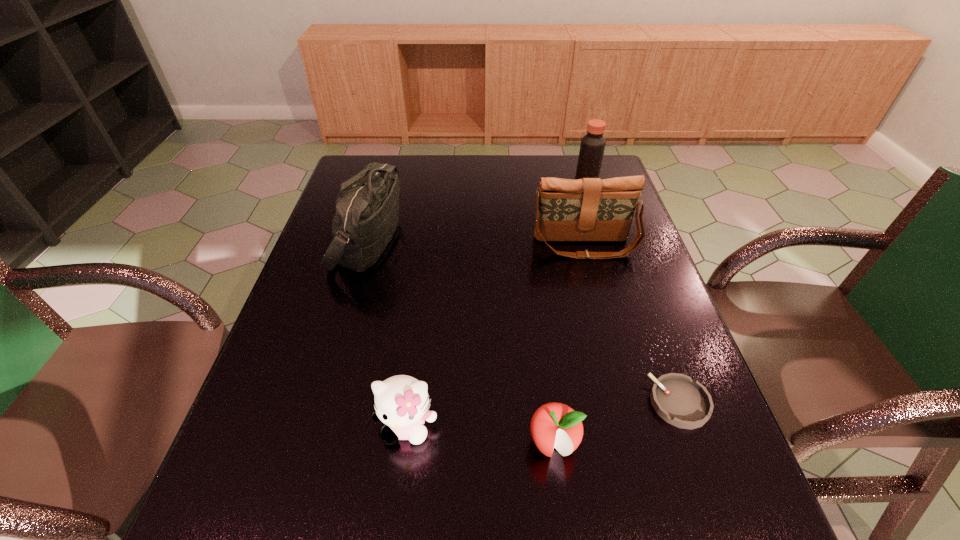
The height and width of the screenshot is (540, 960). I want to click on the leftmost object, so click(x=367, y=207).

Where is `the taller shoulder bag`? This screenshot has width=960, height=540. the taller shoulder bag is located at coordinates (367, 207).

The width and height of the screenshot is (960, 540). I want to click on vinegar, so click(x=592, y=147).

The image size is (960, 540). Identify the location of the right shoulder bag. (589, 209).

At what (x,y) coordinates should I click in order to perform the action: click on the third shortest object. Please return your answer as a coordinate pair (x, y). The height and width of the screenshot is (540, 960). Looking at the image, I should click on coord(401,402).

Where is `the second object from left to right`? Image resolution: width=960 pixels, height=540 pixels. the second object from left to right is located at coordinates (401, 402).

Where is `the second shortest object`? the second shortest object is located at coordinates (x=554, y=424).

Locate an element on the screen. ashtray is located at coordinates (682, 402).

Locate an element on the screen. The width and height of the screenshot is (960, 540). vacant position located 0.310m at the front padded panel of the taller shoulder bag is located at coordinates (512, 242).

You are a GUI agent. You are given a task and a screenshot of the screen. Output one action in this format:
    pyautogui.click(x=<x>, y=<y>)
    Task: Click on the vacant space located 0.280m on the left of the vinegar
    
    Given the screenshot: What is the action you would take?
    pyautogui.click(x=489, y=186)